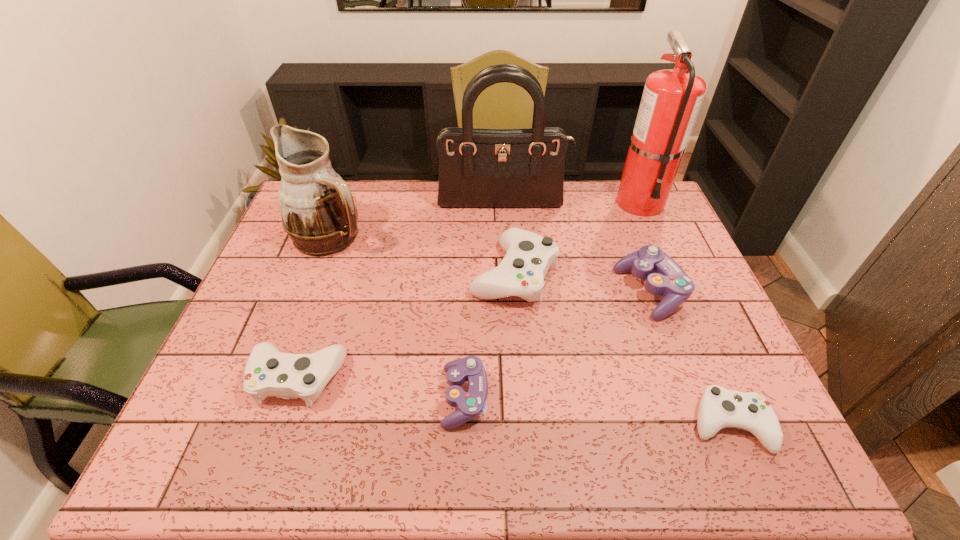
Identify the location of object present at the near right corner. Image resolution: width=960 pixels, height=540 pixels. (719, 408).

Image resolution: width=960 pixels, height=540 pixels. In the image, there is a desktop. In order to click on vacant space at the far edge in this screenshot , I will do `click(595, 200)`.

In the image, there is a desktop. Identify the location of vacant area at the near edge. (468, 449).

I want to click on vacant position at the left edge of the desktop, so click(269, 284).

I want to click on vacant space at the right edge of the desktop, so click(x=718, y=346).

You are a GUI agent. You are given a task and a screenshot of the screen. Output one action in this format:
    pyautogui.click(x=<x>, y=<y>)
    Task: Click on the vacant area between the nearer purple control and the handbag
    The image size is (960, 540).
    Given the screenshot: What is the action you would take?
    pyautogui.click(x=484, y=301)

You are a GUI agent. You are given a task and a screenshot of the screen. Output one action in this format:
    pyautogui.click(x=<x>, y=<y>)
    Task: Click on the free space that is in between the pitcher and the farthest white control
    
    Given the screenshot: What is the action you would take?
    click(x=422, y=255)

This screenshot has height=540, width=960. In order to click on empty space that is in between the smallest white control and the farthest white control in this screenshot , I will do `click(622, 349)`.

I want to click on unoccupied position between the brown pitcher and the leftmost white control, so click(x=315, y=307).

At what (x,y) coordinates should I click in order to perform the action: click on vacant area that lies between the third tallest object and the shortest object. Please return your answer as a coordinate pair (x, y). The height and width of the screenshot is (540, 960). Looking at the image, I should click on (531, 330).